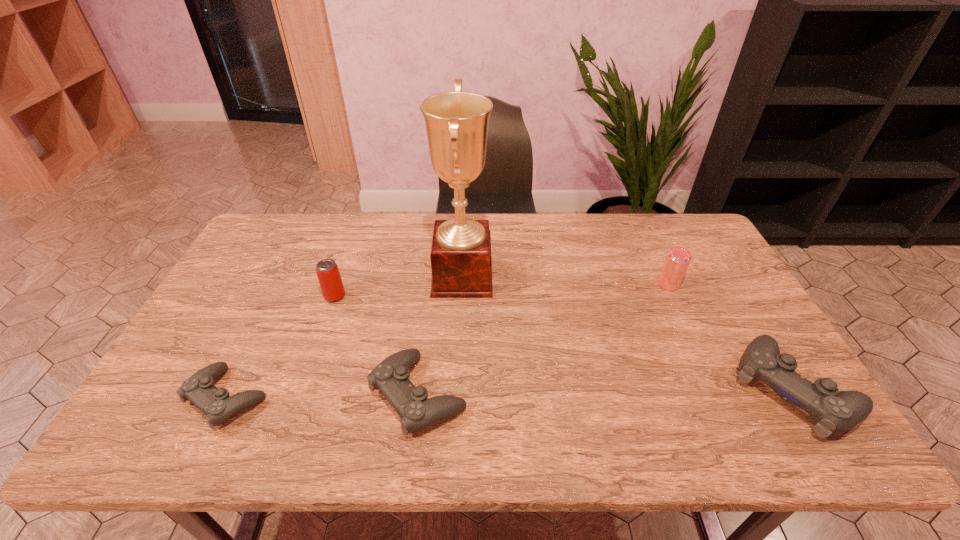
Image resolution: width=960 pixels, height=540 pixels. In order to click on vacant space situated on the right of the second tallest control in this screenshot , I will do `click(574, 395)`.

The width and height of the screenshot is (960, 540). What are the coordinates of `blank space located 0.360m on the left of the rightmost control` in the screenshot? It's located at (589, 389).

This screenshot has height=540, width=960. Identify the location of vacant region located 0.310m on the front of the left beer can. point(300,394).

Where is `vacant space located on the plaque of the tallest object`? vacant space located on the plaque of the tallest object is located at coordinates (571, 277).

I want to click on free space located 0.260m on the left of the second object from right to left, so 574,284.

Locate an element on the screen. This screenshot has width=960, height=540. object that is positioned at the far edge is located at coordinates (456, 122).

Find the location of a particular element. This screenshot has width=960, height=540. object that is at the left edge is located at coordinates (199, 389).

Locate an element on the screen. This screenshot has width=960, height=540. object at the right edge is located at coordinates (833, 412).

I want to click on object that is at the near left corner, so click(x=199, y=389).

This screenshot has height=540, width=960. I want to click on object that is positioned at the near right corner, so click(833, 412).